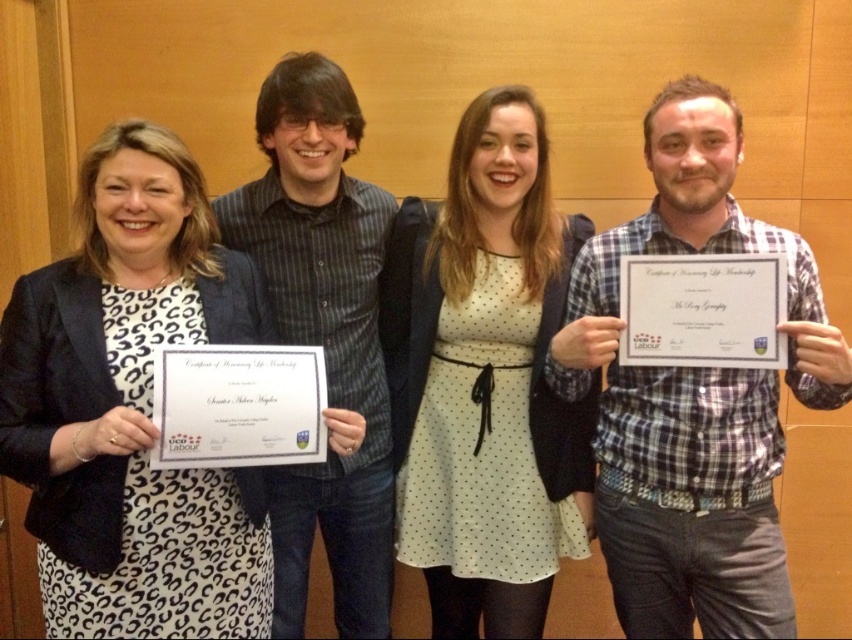
Question: Does striped shirt at center have a larger size compared to white paper certificate at right?

Choices:
 (A) no
 (B) yes

Answer: (B)

Question: Is plaid shirt at center above striped shirt at center?

Choices:
 (A) yes
 (B) no

Answer: (B)

Question: Based on their relative distances, which object is farther from the white paper certificate at right?

Choices:
 (A) leopard print dress at center
 (B) white dotted dress at center
 (C) white paper certificate at center

Answer: (A)

Question: Estimate the real-world distances between objects in this image. Which object is farther from the striped shirt at center?

Choices:
 (A) white paper certificate at right
 (B) white paper certificate at center
 (C) white dotted dress at center

Answer: (A)

Question: Does striped shirt at center have a smaller size compared to white paper certificate at center?

Choices:
 (A) yes
 (B) no

Answer: (B)

Question: Which is nearer to the white paper certificate at right?

Choices:
 (A) white dotted dress at center
 (B) leopard print dress at center
 (C) white paper certificate at center

Answer: (A)